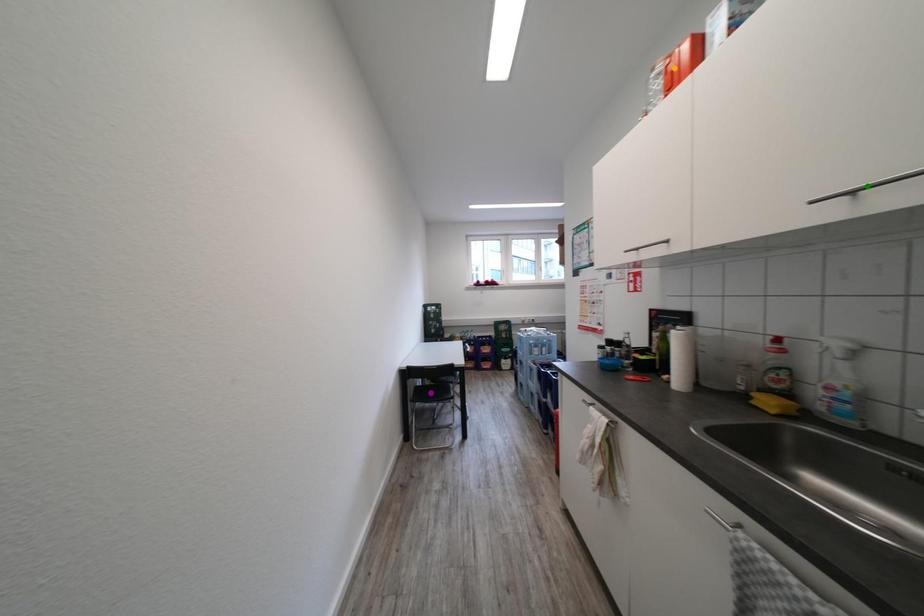
Order these from nearest to farthest:
1. green point
2. purple point
3. orange point

1. green point
2. orange point
3. purple point